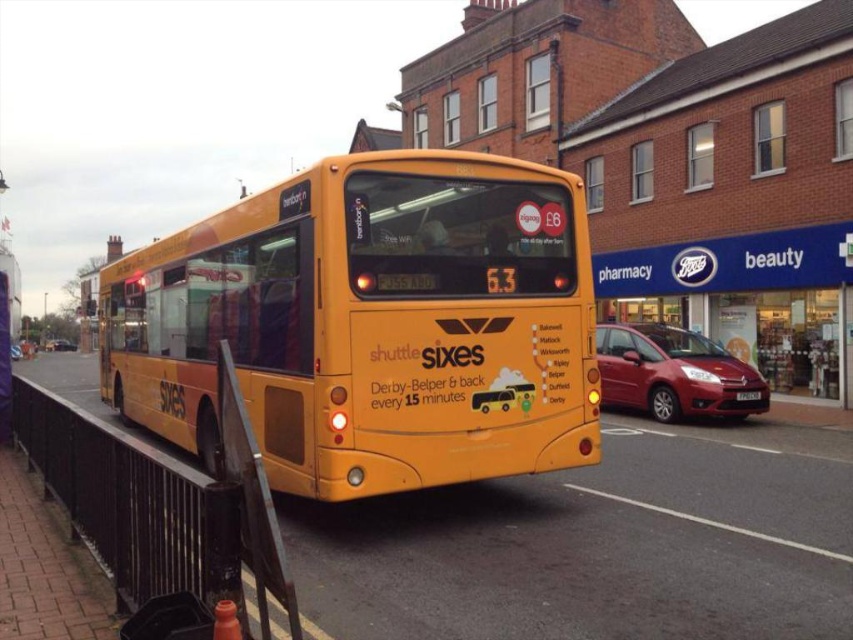
Is shiny black car at center to the right of metallic silver car at center from the viewer's perspective?

Incorrect, shiny black car at center is not on the right side of metallic silver car at center.

Can you confirm if shiny black car at center is taller than metallic silver car at center?

No.

Measure the distance between point (x=48, y=346) and camera.

288.91 feet

Where is `shiny black car at center`? This screenshot has width=853, height=640. shiny black car at center is located at coordinates (61, 346).

Which is above, yellow matte/decorative bus at center or shiny black car at center?

yellow matte/decorative bus at center is above.

Between yellow matte/decorative bus at center and shiny black car at center, which one is positioned lower?

shiny black car at center is below.

Identify the location of yellow matte/decorative bus at center. The height and width of the screenshot is (640, 853). (370, 323).

Who is positioned more to the right, metallic red hatchback at center-right or black plastic license plate at rear?

black plastic license plate at rear

Describe the element at coordinates (672, 372) in the screenshot. I see `metallic red hatchback at center-right` at that location.

This screenshot has width=853, height=640. What do you see at coordinates (672, 372) in the screenshot? I see `metallic red hatchback at center-right` at bounding box center [672, 372].

Identify the location of metallic red hatchback at center-right. This screenshot has height=640, width=853. (672, 372).